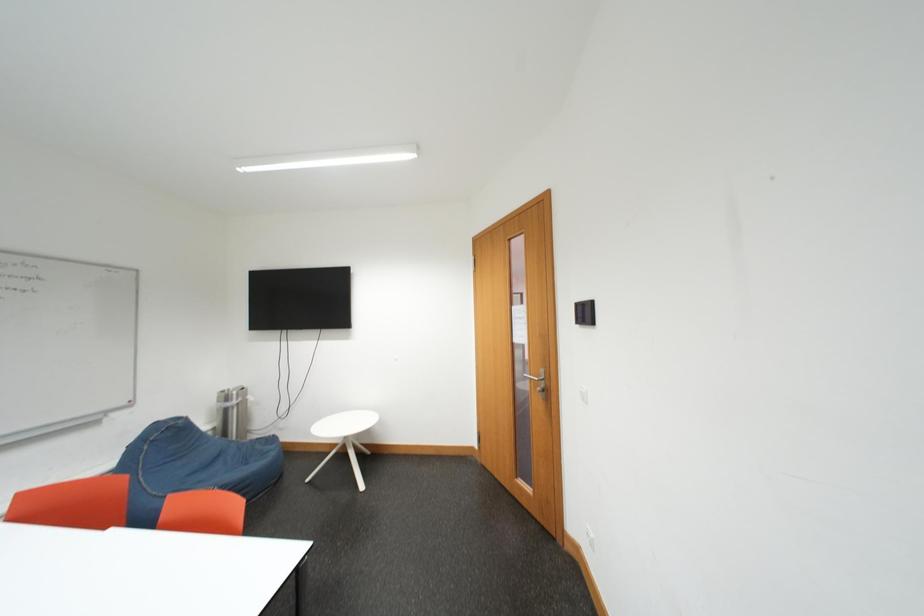
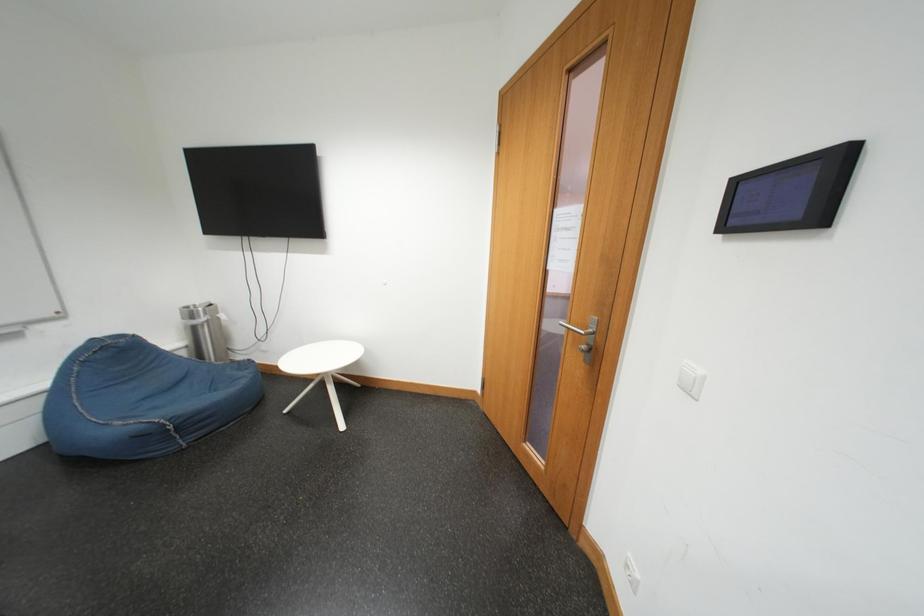
Question: In a continuous first-person perspective shot, in which direction is the camera moving?

Choices:
 (A) Left
 (B) Right
 (C) Forward
 (D) Backward

Answer: (C)